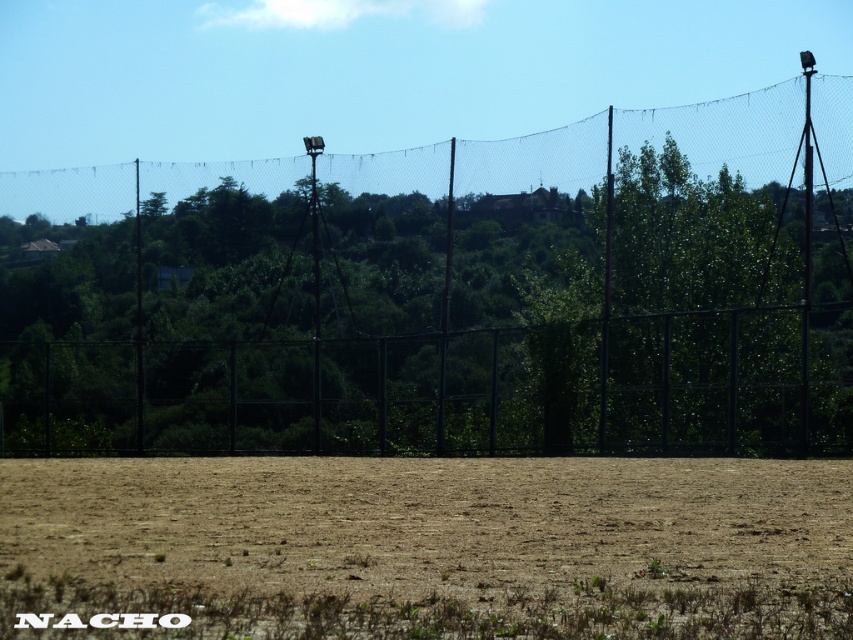
Question: Which of the following is the closest to the observer?

Choices:
 (A) (143, 440)
 (B) (440, 611)

Answer: (B)

Question: Is black wire mesh fence at upper center below brown sandy soil at center?

Choices:
 (A) no
 (B) yes

Answer: (A)

Question: Can you confirm if black wire mesh fence at upper center is wider than brown sandy soil at center?

Choices:
 (A) yes
 (B) no

Answer: (A)

Question: Is black wire mesh fence at upper center closer to camera compared to brown sandy soil at center?

Choices:
 (A) no
 (B) yes

Answer: (A)

Question: Among these points, which one is nearest to the camera?

Choices:
 (A) (621, 145)
 (B) (706, 524)

Answer: (B)

Question: Which of the following is the closest to the observer?

Choices:
 (A) black wire mesh fence at upper center
 (B) brown sandy soil at center

Answer: (B)